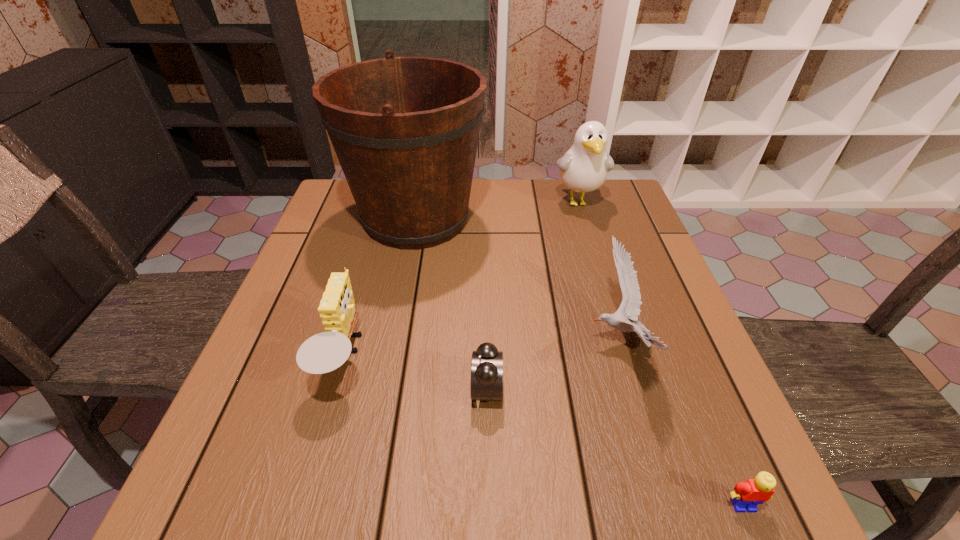
This screenshot has height=540, width=960. I want to click on vacant space that satisfies the following two spatial constraints: 1. on the front side of the bucket; 2. on the front-facing side of the sponge, so click(x=391, y=356).

The height and width of the screenshot is (540, 960). Identify the location of free location that satisfies the following two spatial constraints: 1. on the beak of the second tallest object; 2. on the front-facing side of the sponge. (626, 356).

Identify the location of vacant space that satisfies the following two spatial constraints: 1. on the front side of the bucket; 2. on the front-facing side of the sponge. This screenshot has height=540, width=960. (391, 356).

Identify the location of free point that satisfies the following two spatial constraints: 1. on the beak of the farther gull; 2. on the front-facing side of the sponge. This screenshot has width=960, height=540. (626, 356).